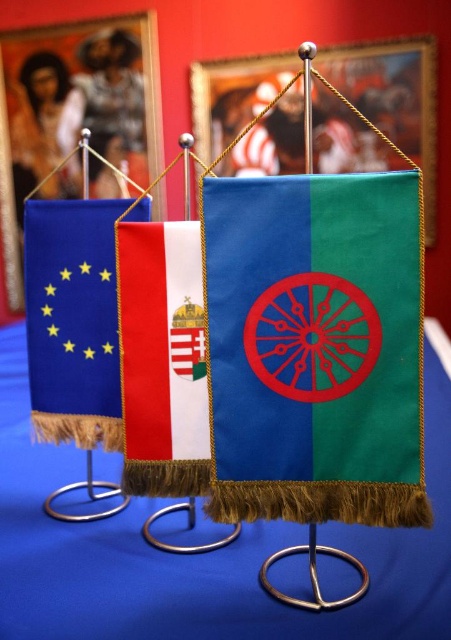
Is green fabric flag at center shorter than blue fabric flag at left?

Incorrect, green fabric flag at center's height does not fall short of blue fabric flag at left's.

Looking at this image, can you confirm if green fabric flag at center is positioned to the right of blue fabric flag at left?

Indeed, green fabric flag at center is positioned on the right side of blue fabric flag at left.

Between point (350, 218) and point (109, 435), which one is positioned in front?

Point (350, 218) is in front.

Find the location of `green fabric flag at center`. green fabric flag at center is located at coordinates (314, 348).

Is brushed metal picture frame at upper left behind red velvet flag at center?

→ Yes, it is.

Between point (31, 115) and point (138, 316), which one is positioned in front?

Positioned in front is point (138, 316).

This screenshot has height=640, width=451. Find the location of `brushed metal picture frame at upper left`. brushed metal picture frame at upper left is located at coordinates (73, 108).

Which is below, brushed metal picture frame at upper left or blue fabric flag at left?

Positioned lower is blue fabric flag at left.

Does brushed metal picture frame at upper left lie in front of blue fabric flag at left?

No.

Locate an element on the screen. The image size is (451, 640). brushed metal picture frame at upper left is located at coordinates (73, 108).